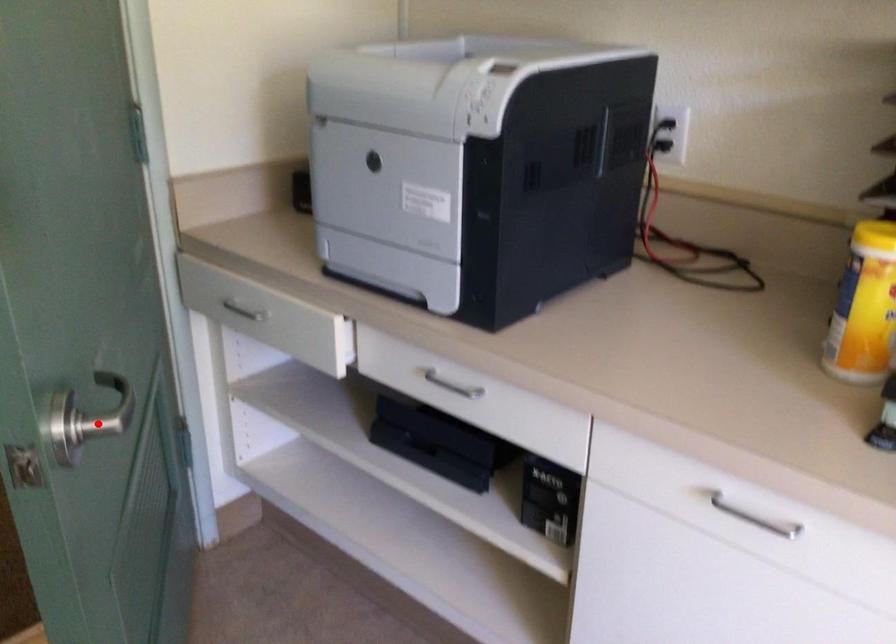
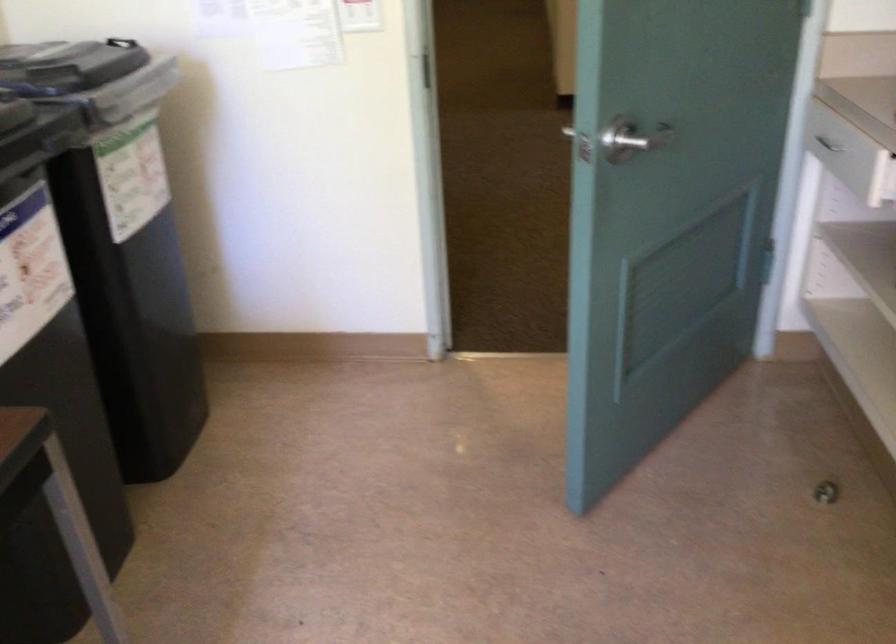
Question: I am providing you with two images of the same scene from different viewpoints. Image1 has a red point marked. In image2, the corresponding 3D location appears at what relative position? Reply with the corresponding letter.

Choices:
 (A) Closer
 (B) Farther

Answer: (B)